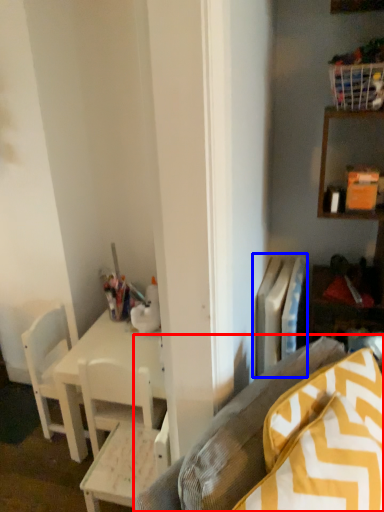
Question: Which of the following is the closest to the observer, studio couch (highlighted by a red box) or radiator (highlighted by a blue box)?

Choices:
 (A) studio couch
 (B) radiator

Answer: (A)